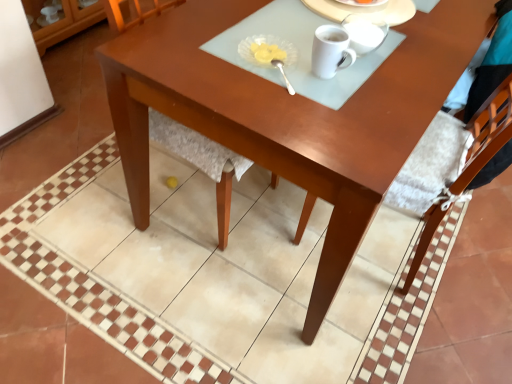
Question: In the image, is wooden chair at center on the left side or the right side of white glossy mug at upper center, which is the 4th tableware in bottom-to-top order?

Choices:
 (A) right
 (B) left

Answer: (B)

Question: Is wooden chair at center bigger or smaller than white glossy mug at upper center, which appears as the first tableware when viewed from the top?

Choices:
 (A) small
 (B) big

Answer: (B)

Question: Estimate the real-world distances between objects in this image. Which object is farther from the glossy wood desk at center?

Choices:
 (A) translucent glass dish at upper center, the 2th tableware ordered from the bottom
 (B) white glossy mug at upper center, which is the 4th tableware in bottom-to-top order
 (C) wooden chair at center
 (D) white glossy mug at upper center
 (E) white glossy mug at upper center, arranged as the second tableware when viewed from the top

Answer: (B)

Question: Based on their relative distances, which object is nearer to the glossy wood desk at center?

Choices:
 (A) white glossy mug at upper center, which is the 4th tableware in bottom-to-top order
 (B) wooden chair at center
 (C) silver metallic spoon at center, which appears as the fourth tableware when viewed from the top
 (D) white glossy mug at upper center, arranged as the second tableware when viewed from the top
 (E) white glossy mug at upper center

Answer: (B)